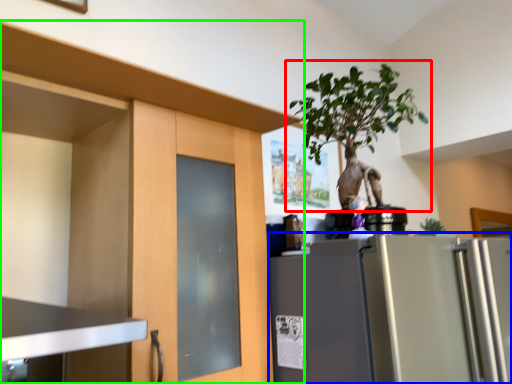
Question: Estimate the real-world distances between objects in this image. Which object is closer to houseplant (highlighted by a red box), refrigerator (highlighted by a blue box) or cabinetry (highlighted by a green box)?

Choices:
 (A) refrigerator
 (B) cabinetry

Answer: (B)